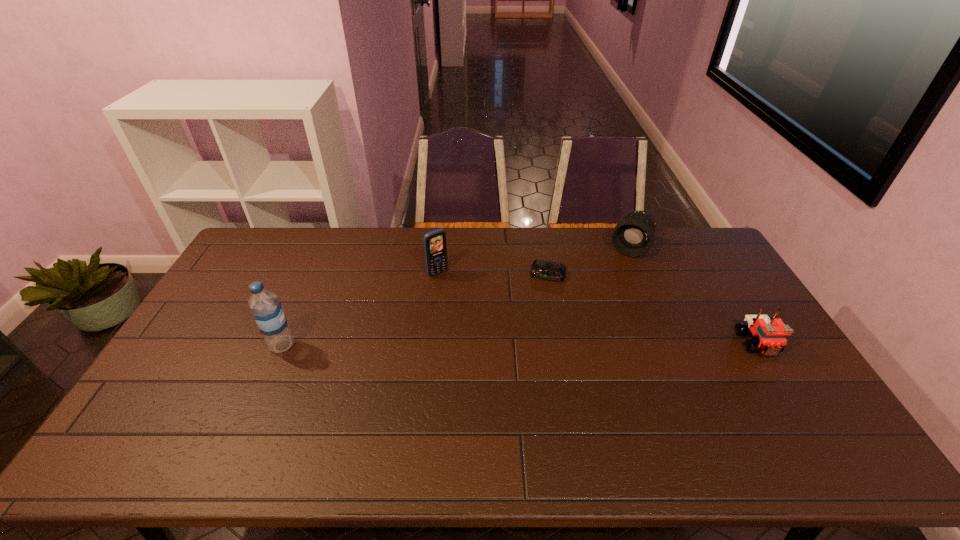
Identify the location of object that can be found as the fourth closest to the second tallest object. (768, 334).

The height and width of the screenshot is (540, 960). I want to click on object that is the second closest to the shortest object, so click(435, 247).